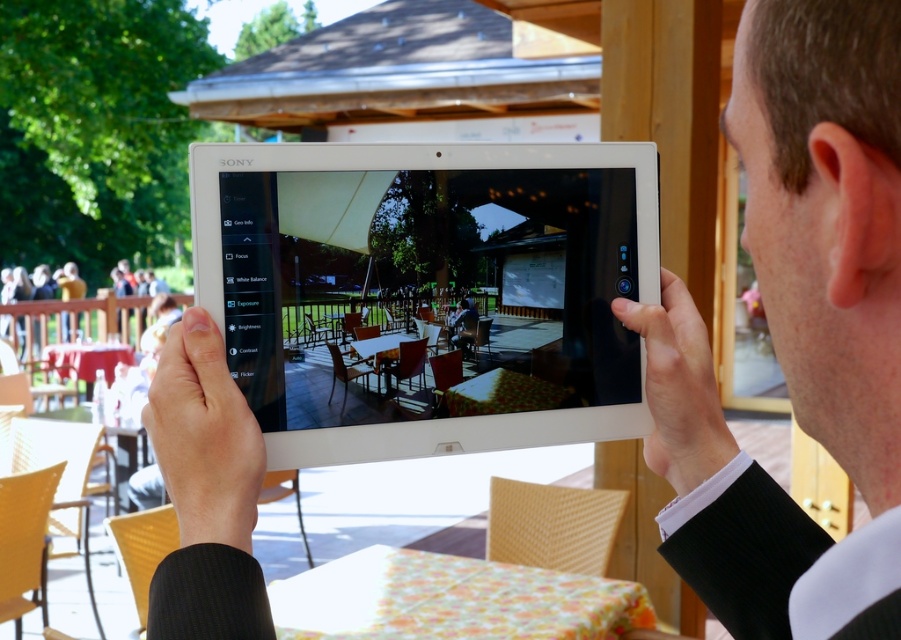
Is white glossy tablet at center taller than smooth skin hand at center?

Yes.

You are a GUI agent. You are given a task and a screenshot of the screen. Output one action in this format:
    pyautogui.click(x=<x>, y=<y>)
    Task: Click on the white glossy tablet at center
    This screenshot has width=901, height=640.
    Given the screenshot: What is the action you would take?
    pyautogui.click(x=426, y=291)

Where is `white glossy tablet at center`? white glossy tablet at center is located at coordinates click(x=426, y=291).

In the scene shown: Is white glossy tablet at center thinner than white matte tablet at center?

In fact, white glossy tablet at center might be wider than white matte tablet at center.

Is white glossy tablet at center smaller than white matte tablet at center?

Incorrect, white glossy tablet at center is not smaller in size than white matte tablet at center.

This screenshot has height=640, width=901. Find the location of `white glossy tablet at center`. white glossy tablet at center is located at coordinates click(426, 291).

Can you confirm if smooth skin hand at center is shorter than white matte tablet at center?

Yes.

Is point (178, 384) farther from camera compared to point (667, 476)?

That is False.

Where is `smooth skin hand at center`? The height and width of the screenshot is (640, 901). smooth skin hand at center is located at coordinates (205, 436).